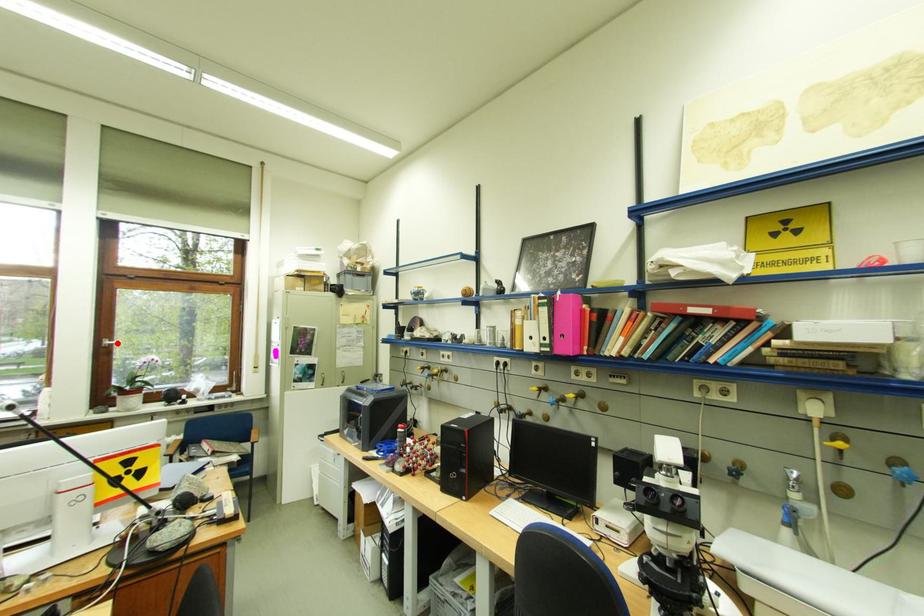
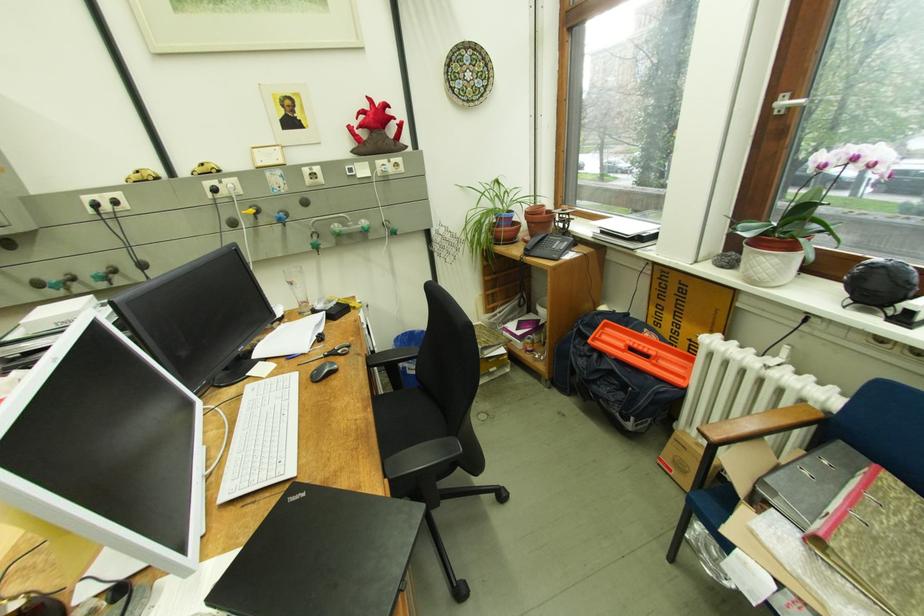
The point at the highlighted location is marked in the first image. Where is the corresponding point in the second image?

(794, 103)